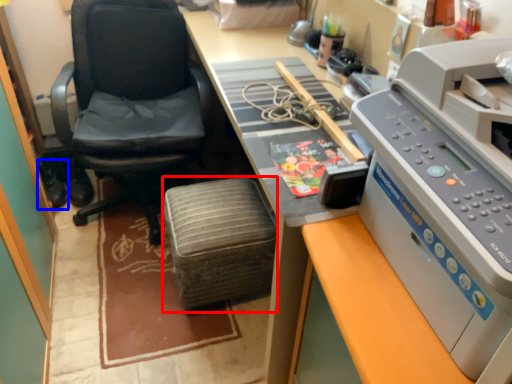
Question: Which object is further to the camera taking this photo, stool (highlighted by a red box) or footwear (highlighted by a blue box)?

Choices:
 (A) stool
 (B) footwear

Answer: (B)